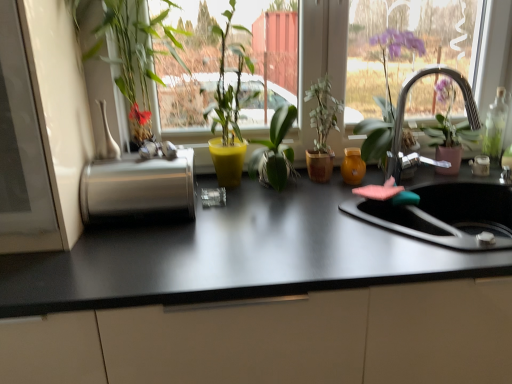
Question: From a real-world perspective, is silver metallic faucet at upper right on top of transparent glass bottle at right?

Choices:
 (A) yes
 (B) no

Answer: (A)

Question: Is the position of silver metallic faucet at upper right more distant than that of transparent glass bottle at right?

Choices:
 (A) no
 (B) yes

Answer: (A)

Question: Is silver metallic faucet at upper right bigger than transparent glass bottle at right?

Choices:
 (A) no
 (B) yes

Answer: (B)

Question: Considering the relative sizes of silver metallic faucet at upper right and transparent glass bottle at right in the image provided, is silver metallic faucet at upper right taller than transparent glass bottle at right?

Choices:
 (A) yes
 (B) no

Answer: (A)

Question: Is silver metallic faucet at upper right turned away from transparent glass bottle at right?

Choices:
 (A) no
 (B) yes

Answer: (A)

Question: Does point (375, 218) appear closer or farther from the camera than point (110, 145)?

Choices:
 (A) farther
 (B) closer

Answer: (B)

Question: Is pink sponge at right in front of or behind white glossy vase at upper left, positioned as the 2th vase in back-to-front order, in the image?

Choices:
 (A) front
 (B) behind

Answer: (A)

Question: Is pink sponge at right to the left or to the right of white glossy vase at upper left, the second vase in the right-to-left sequence, in the image?

Choices:
 (A) right
 (B) left

Answer: (A)

Question: From a real-world perspective, is pink sponge at right positioned above or below white glossy vase at upper left, the 1th vase when ordered from front to back?

Choices:
 (A) above
 (B) below

Answer: (B)

Question: Based on their positions, is translucent amber glass at sink right, which is the 1th vase from right to left, located to the left or right of transparent glass window at center?

Choices:
 (A) left
 (B) right

Answer: (B)

Question: From a real-world perspective, is translucent amber glass at sink right, which ranks as the second vase in left-to-right order, above or below transparent glass window at center?

Choices:
 (A) below
 (B) above

Answer: (A)

Question: Considering the positions of translucent amber glass at sink right, which ranks as the second vase in left-to-right order, and transparent glass window at center in the image, is translucent amber glass at sink right, which ranks as the second vase in left-to-right order, bigger or smaller than transparent glass window at center?

Choices:
 (A) small
 (B) big

Answer: (A)

Question: In the image, is translucent amber glass at sink right, which ranks as the second vase in left-to-right order, positioned in front of or behind transparent glass window at center?

Choices:
 (A) behind
 (B) front

Answer: (A)

Question: From the image's perspective, relative to silver metallic faucet at upper right, is brushed metal paper towel holder at left above or below?

Choices:
 (A) above
 (B) below

Answer: (B)

Question: Considering the positions of brushed metal paper towel holder at left and silver metallic faucet at upper right in the image, is brushed metal paper towel holder at left wider or thinner than silver metallic faucet at upper right?

Choices:
 (A) wide
 (B) thin

Answer: (A)